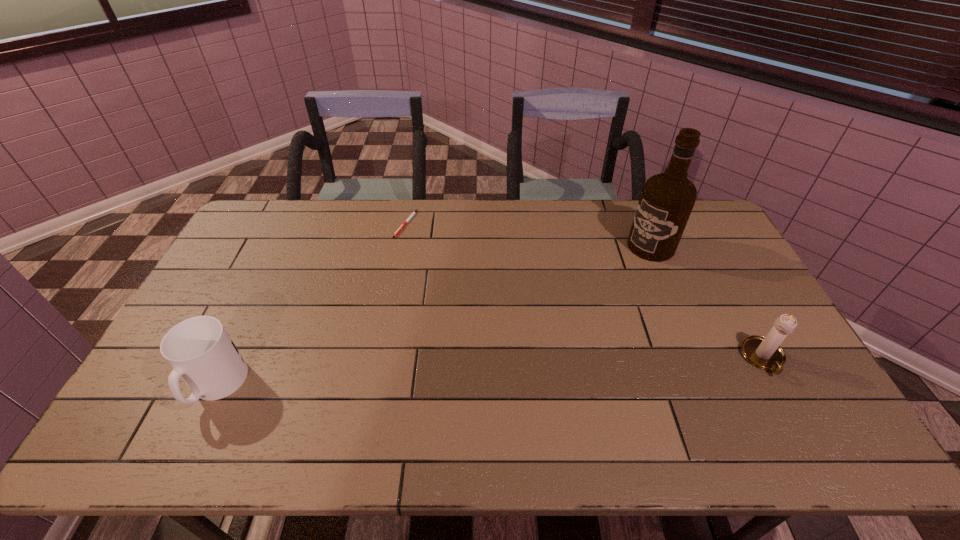
This screenshot has width=960, height=540. Identify the location of vacant space at the near edge of the desktop. (439, 402).

Locate an element on the screen. vacant area at the left edge is located at coordinates (262, 244).

In the image, there is a desktop. Find the location of `vacant space at the far left corner`. vacant space at the far left corner is located at coordinates (276, 217).

What are the coordinates of `free space between the candle holder and the mug` in the screenshot? It's located at (491, 372).

Locate an element on the screen. unoccupied position between the shortest object and the leftmost object is located at coordinates (311, 305).

Locate an element on the screen. The image size is (960, 540). vacant space that is in between the candle holder and the mug is located at coordinates (491, 372).

At what (x,y) coordinates should I click in order to perform the action: click on vacant area that lies between the tallest object and the leftmost object. Please return your answer as a coordinate pair (x, y). This screenshot has height=540, width=960. Looking at the image, I should click on [434, 316].

Locate an element on the screen. The height and width of the screenshot is (540, 960). unoccupied area between the alcohol and the candle holder is located at coordinates (708, 302).

Where is `free space between the mug and the third object from right to left`? The image size is (960, 540). free space between the mug and the third object from right to left is located at coordinates (311, 305).

Where is `vacant space that is in between the tallest object and the shortest object`? The width and height of the screenshot is (960, 540). vacant space that is in between the tallest object and the shortest object is located at coordinates pos(528,235).